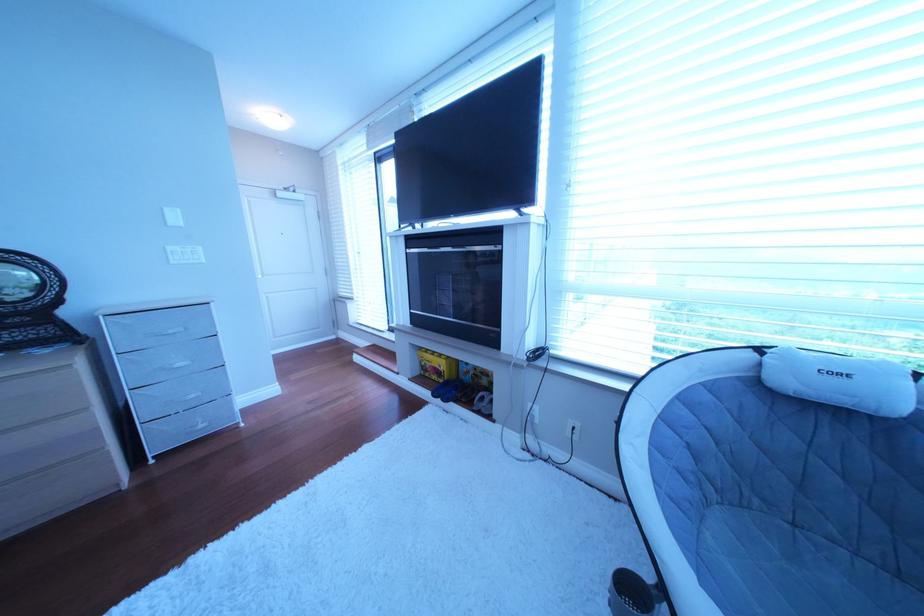
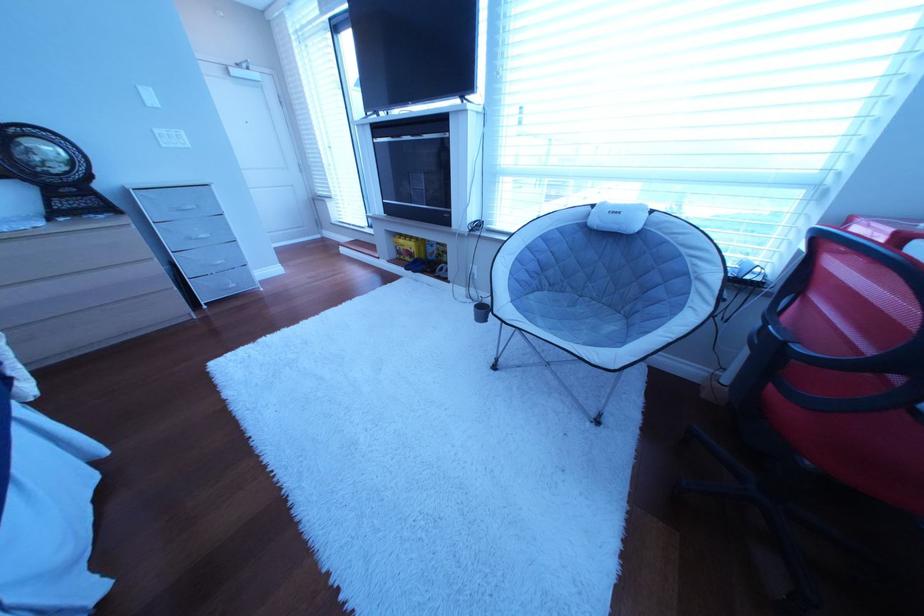
Question: The first image is from the beginning of the video and the second image is from the end. How did the camera likely rotate when shooting the video?

Choices:
 (A) Left
 (B) Right
 (C) Up
 (D) Down

Answer: (D)